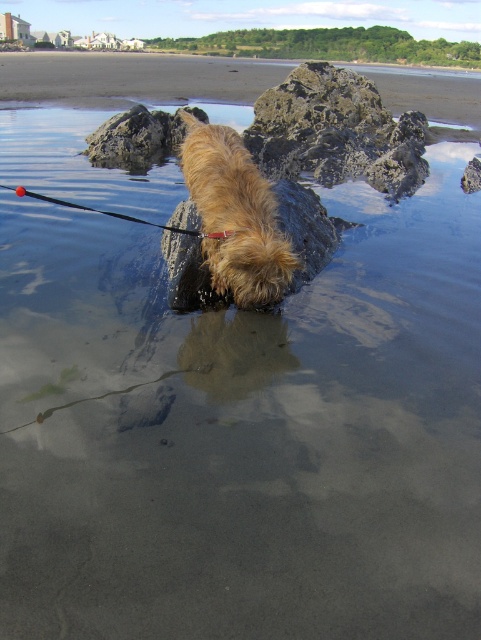
Which is below, smooth sand beach at center or fuzzy brown dog at center?

fuzzy brown dog at center

In the scene shown: Who is shorter, smooth sand beach at center or fuzzy brown dog at center?

With less height is fuzzy brown dog at center.

Between point (164, 97) and point (219, 289), which one is positioned behind?

The point (164, 97) is more distant.

This screenshot has width=481, height=640. I want to click on smooth sand beach at center, so click(133, 77).